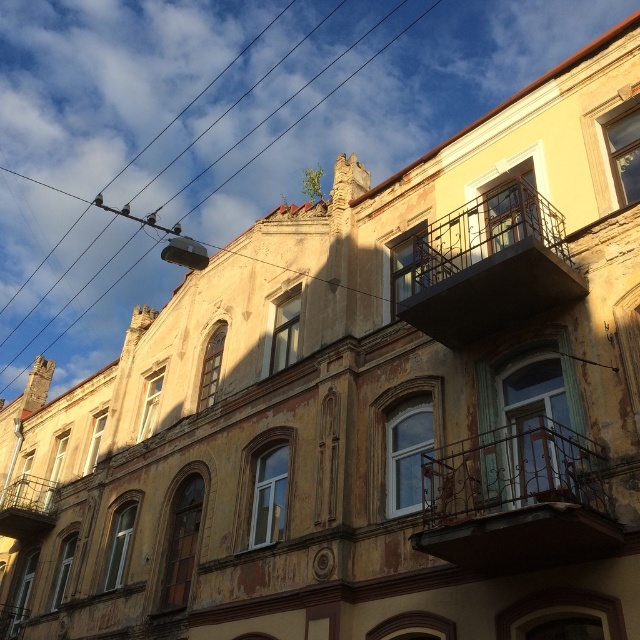
You are standing in front of the building and see two points marked on its facade. The first point is at coordinate point(536, 436) and the second is at point(468, 332). Which point is closer to you?

Point(536, 436) is in front of point(468, 332), so it is closer to you.

Looking at this image, you are a window cleaner standing on the ground floor of the building. You need to reach the metallic wire at upper center and the rusty metal balcony at lower left. Which object is higher up and requires a taller ladder?

The metallic wire at upper center is much taller than the rusty metal balcony at lower left, so you need a taller ladder to reach the metallic wire at upper center.